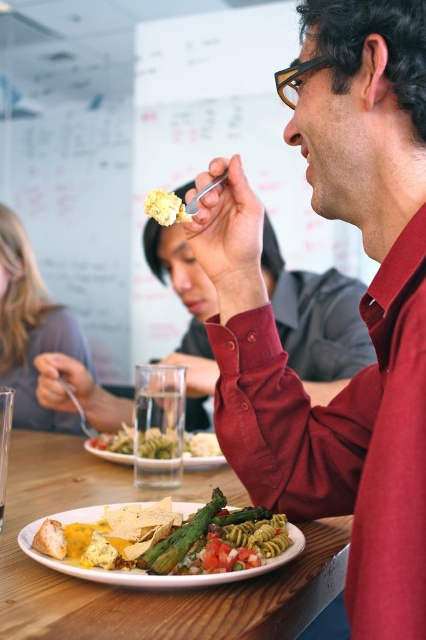
You are a food delivery robot that needs to place a new dish on the table without disturbing the existing items. The new dish must be placed at point coordinates exactly at point [141,570]. According to the scene description, what object is currently located at that point?

The point [141,570] is on matte yellow plate with pasta and vegetables at center.

You are an interior designer assessing the color contrast in this office dining area. Considering the matte gray sweater at upper left and the matte yellow plate with pasta and vegetables at center, which object would you say has a larger physical size?

The matte gray sweater at upper left is larger in size than the matte yellow plate with pasta and vegetables at center.

You are a food delivery person who needs to place a hot dish on the table. The dish is too hot to touch, so you must set it down carefully. The green asparagus at center is currently on the table. Where should you place the dish so that it doesn not fall off the table?

The dish should be placed within 32.90 inches from the green asparagus at center to ensure it stays on the table.